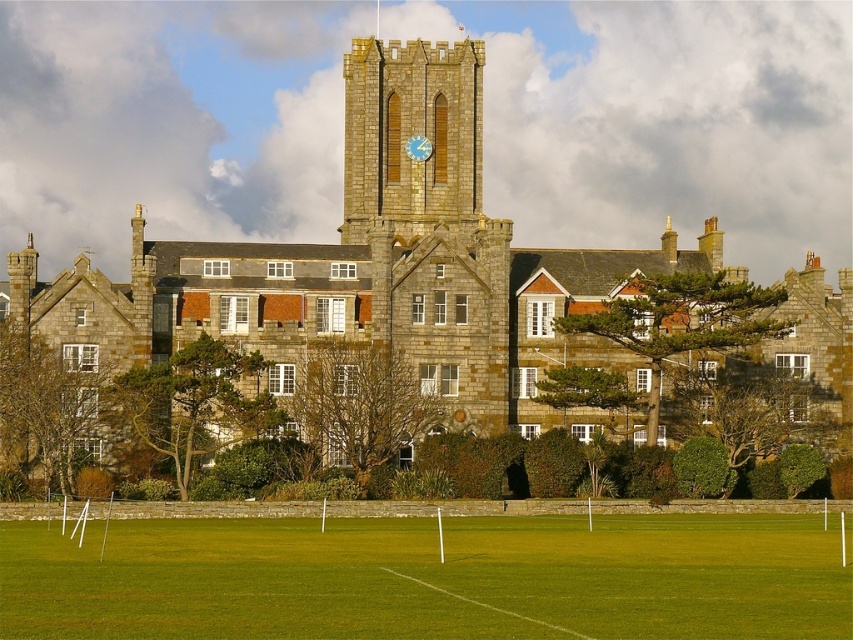
Question: Can you confirm if brown stone church at center is positioned to the right of stone clock tower at center?

Choices:
 (A) no
 (B) yes

Answer: (B)

Question: Is brown stone church at center thinner than stone clock tower at center?

Choices:
 (A) no
 (B) yes

Answer: (A)

Question: Estimate the real-world distances between objects in this image. Which object is closer to the blue wooden clock at center?

Choices:
 (A) stone clock tower at center
 (B) green grass football field at lower center
 (C) brown stone church at center

Answer: (A)

Question: Among these points, which one is nearest to the camera?

Choices:
 (A) (440, 141)
 (B) (422, 148)

Answer: (B)

Question: Where is brown stone church at center located in relation to blue wooden clock at center in the image?

Choices:
 (A) right
 (B) left

Answer: (A)

Question: Which point is farther to the camera?

Choices:
 (A) stone clock tower at center
 (B) brown stone church at center

Answer: (A)